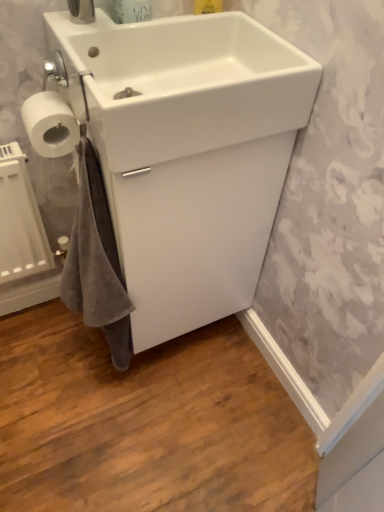
Where is `vacant space in front of white glossy sink at center, marked as the second sink in a front-to-back arrangement`? vacant space in front of white glossy sink at center, marked as the second sink in a front-to-back arrangement is located at coordinates (172, 413).